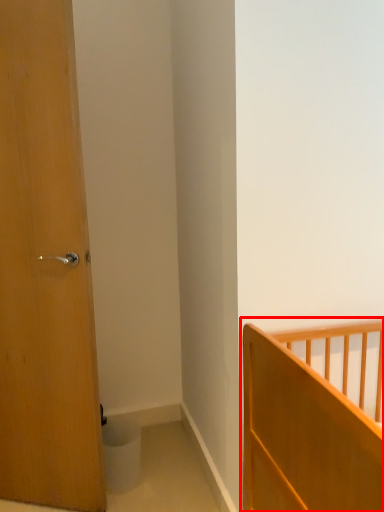
Question: From the image's perspective, what is the correct spatial relationship of bed (annotated by the red box) in relation to door?

Choices:
 (A) above
 (B) below

Answer: (B)